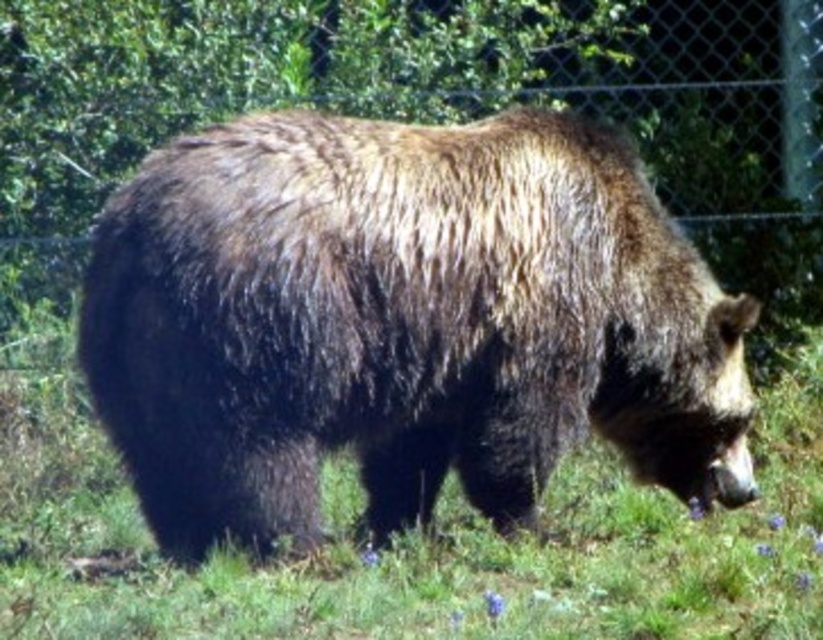
Can you confirm if brown fuzzy bear at center is thinner than brown furry bear at center?

Yes.

Where is `brown fuzzy bear at center`? Image resolution: width=823 pixels, height=640 pixels. brown fuzzy bear at center is located at coordinates (402, 323).

Does brown fuzzy bear at center appear over metallic chain-link fence at upper center?

No, brown fuzzy bear at center is not above metallic chain-link fence at upper center.

Can you confirm if brown fuzzy bear at center is thinner than metallic chain-link fence at upper center?

Indeed, brown fuzzy bear at center has a lesser width compared to metallic chain-link fence at upper center.

Between point (140, 362) and point (96, 166), which one is positioned behind?

The point (96, 166) is more distant.

Where is `brown fuzzy bear at center`? This screenshot has width=823, height=640. brown fuzzy bear at center is located at coordinates (402, 323).

Does metallic chain-link fence at upper center have a greater width compared to brown furry bear at center?

Indeed, metallic chain-link fence at upper center has a greater width compared to brown furry bear at center.

Is metallic chain-link fence at upper center below brown furry bear at center?

No, metallic chain-link fence at upper center is not below brown furry bear at center.

Between point (714, 106) and point (425, 552), which one is positioned behind?

Point (714, 106)

Locate an element on the screen. metallic chain-link fence at upper center is located at coordinates (426, 108).